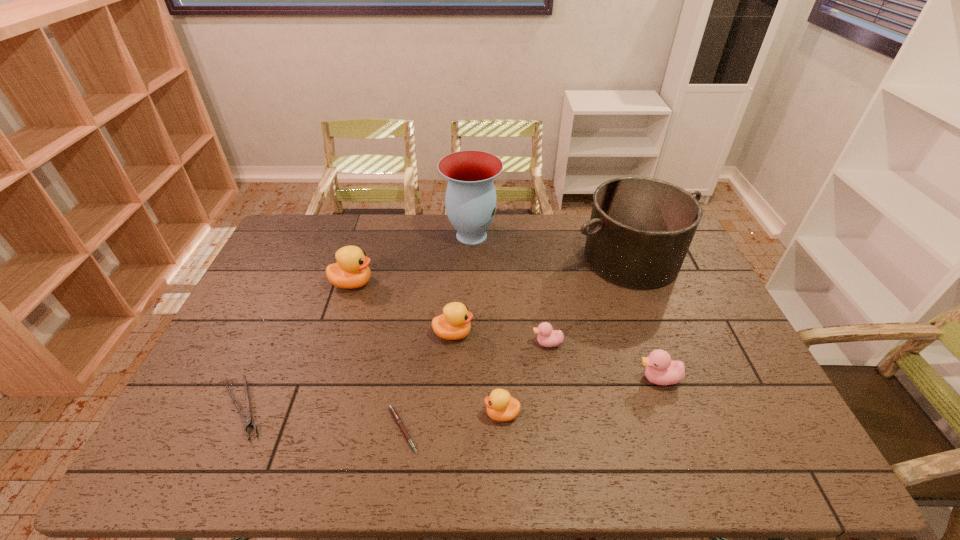
Identify the location of yellow duckling that stands as the second closest to the rightmost duckling. The width and height of the screenshot is (960, 540). (454, 323).

Where is `free spot that satisfies the following two spatial constraints: 1. on the front side of the eighth shortest object; 2. at the nib of the pen`? free spot that satisfies the following two spatial constraints: 1. on the front side of the eighth shortest object; 2. at the nib of the pen is located at coordinates (698, 429).

Find the location of a particular element. The image size is (960, 540). vacant area in the image that satisfies the following two spatial constraints: 1. on the face of the biggest yellow duckling; 2. on the front side of the leftmost object is located at coordinates (313, 408).